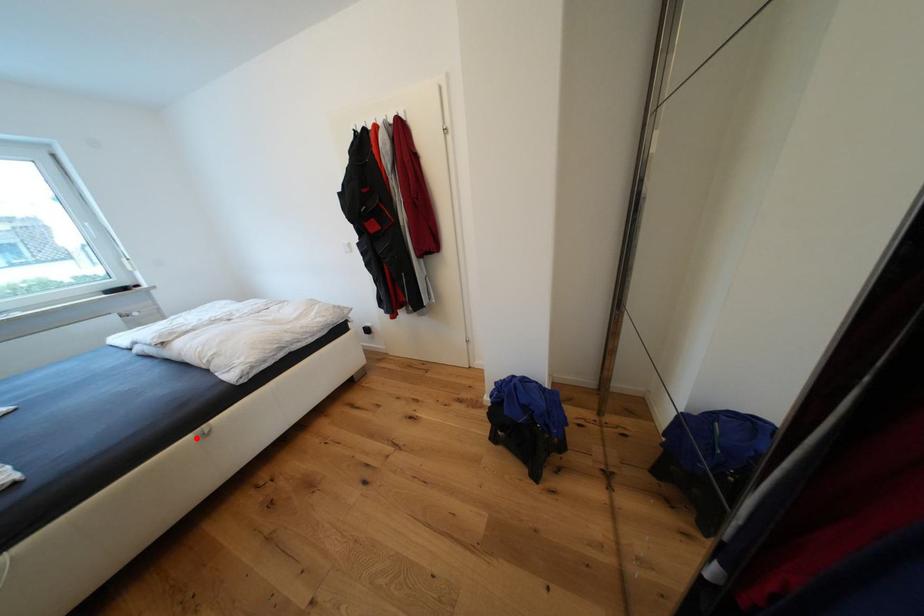
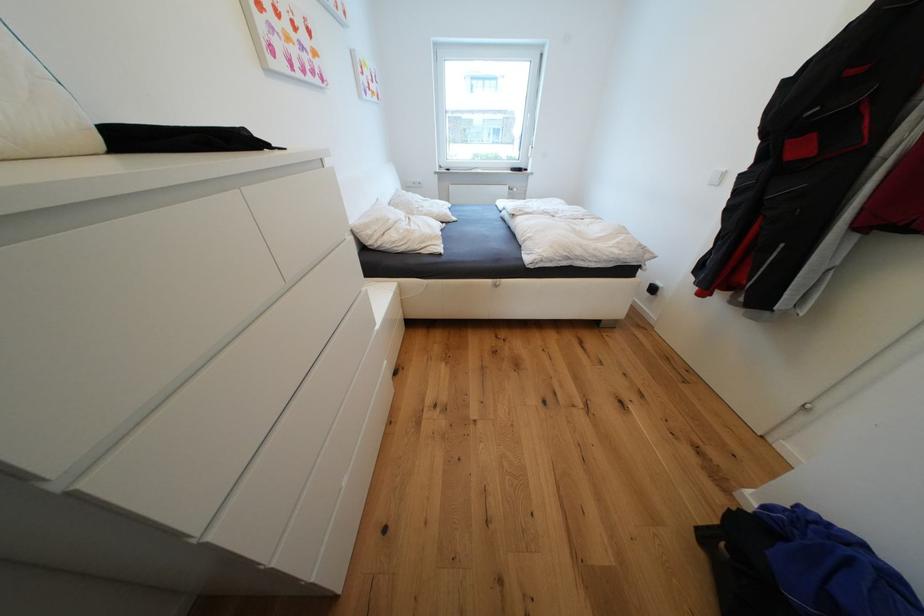
In the second image, find the point that corresponds to the highlighted location in the first image.

(496, 282)